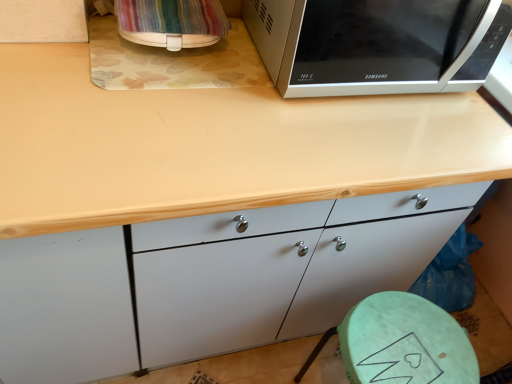
You are a GUI agent. You are given a task and a screenshot of the screen. Output one action in this format:
    pyautogui.click(x=<x>, y=<y>)
    Task: Click on the vacant space in front of sleek silver microwave at upper right
    The image size is (512, 384).
    Given the screenshot: What is the action you would take?
    pyautogui.click(x=323, y=145)